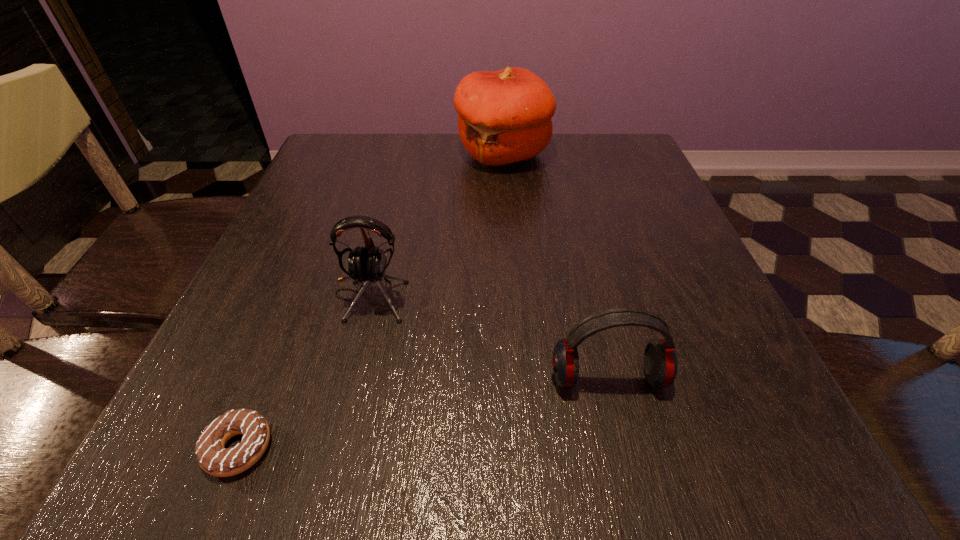
Find the location of a particular element. The image size is (960, 540). pumpkin is located at coordinates (504, 117).

Where is `the tallest object`? The image size is (960, 540). the tallest object is located at coordinates (504, 117).

Find the location of a particular element. Image resolution: width=960 pixels, height=540 pixels. the taller earphone is located at coordinates (368, 264).

At what (x,y) coordinates should I click in order to perform the action: click on the third shortest object. Please return your answer as a coordinate pair (x, y). This screenshot has width=960, height=540. Looking at the image, I should click on (368, 264).

I want to click on the shorter earphone, so click(x=660, y=362).

Locate an element on the screen. the third farthest object is located at coordinates (660, 362).

The width and height of the screenshot is (960, 540). I want to click on doughnut, so click(x=213, y=458).

Find the location of a particular element. This screenshot has height=540, width=960. the leftmost object is located at coordinates (213, 458).

Locate an element on the screen. Image resolution: width=960 pixels, height=540 pixels. free space located 0.280m on the front of the farthest object is located at coordinates (511, 260).

The image size is (960, 540). In order to click on vacant point located on the right of the second object from left to right in this screenshot , I will do `click(442, 295)`.